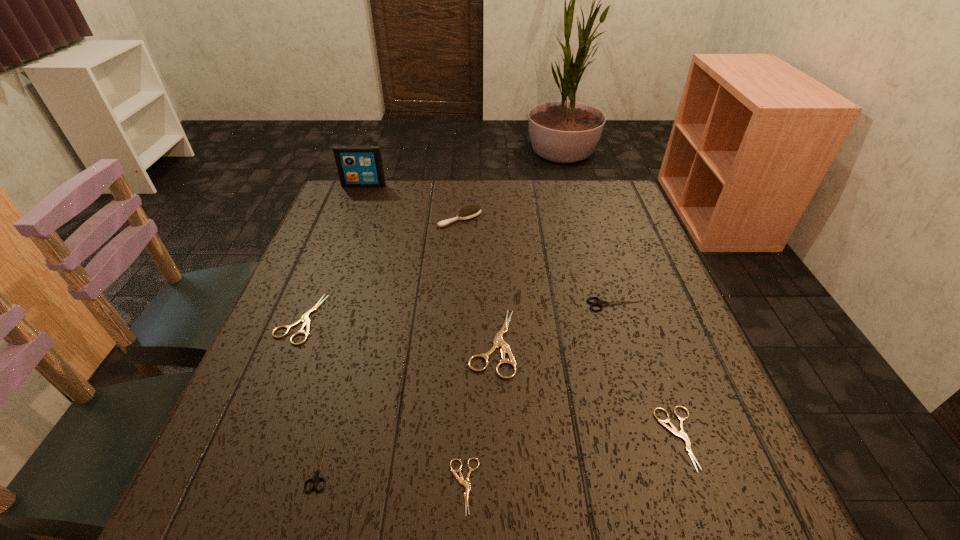
This screenshot has width=960, height=540. What are the coordinates of `the farthest object` in the screenshot? It's located at (358, 165).

This screenshot has width=960, height=540. I want to click on the tallest object, so click(x=358, y=165).

Locate an element on the screen. The width and height of the screenshot is (960, 540). the seventh nearest object is located at coordinates (471, 211).

The image size is (960, 540). Find the location of `scrubbing brush`. scrubbing brush is located at coordinates (471, 211).

Find the location of `the biggest beige shears`. the biggest beige shears is located at coordinates (498, 341).

Where is `the farther black shears`? the farther black shears is located at coordinates 600,303.

The height and width of the screenshot is (540, 960). I want to click on the right black shears, so click(x=600, y=303).

Locate an element on the screen. the leftmost beige shears is located at coordinates (305, 319).

Identify the location of the leftmost shears. (305, 319).

The image size is (960, 540). In order to click on the rightmost beige shears in this screenshot , I will do `click(672, 428)`.